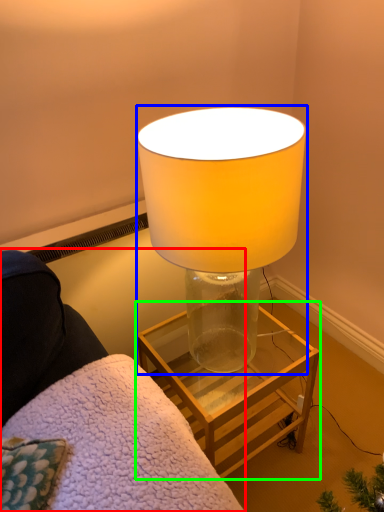
Question: Estimate the real-world distances between objects in this image. Which object is closer to furniture (highlighted by a red box), lamp (highlighted by a blue box) or table (highlighted by a green box)?

Choices:
 (A) lamp
 (B) table

Answer: (A)